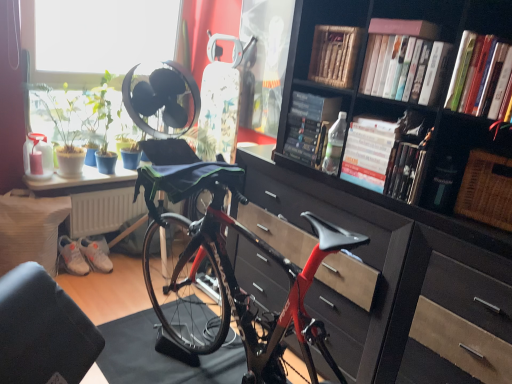
Question: Relative to hardcover book at upper right, which appears as the 1th book when viewed from the front, is woven brown picnic basket at right in front or behind?

Choices:
 (A) behind
 (B) front

Answer: (A)

Question: Do you think woven brown picnic basket at right is within hardcover book at upper right, which appears as the 1th book when viewed from the front, or outside of it?

Choices:
 (A) outside
 (B) inside

Answer: (A)

Question: Estimate the real-world distances between objects in this image. Which object is closer to the white matte sneakers at lower left, which is the 1th sneakers from left to right?

Choices:
 (A) woven brown picnic basket at right
 (B) wooden book at upper center, which appears as the sixth book when viewed from the front
 (C) white matte book at upper center, placed as the 2th book when sorted from front to back
 (D) matte black chest of drawers at center
 (E) hardcover book at center, the 1th book when ordered from back to front

Answer: (D)

Question: Based on their relative distances, which object is farther from the white matte sneakers at lower left, which is the 1th sneakers from left to right?

Choices:
 (A) hardcover book at upper center, which appears as the 5th book when viewed from the front
 (B) white matte book at upper center, the sixth book positioned from the back
 (C) green matte plant at upper left
 (D) woven brown picnic basket at right
 (E) green leafy plant at window

Answer: (D)